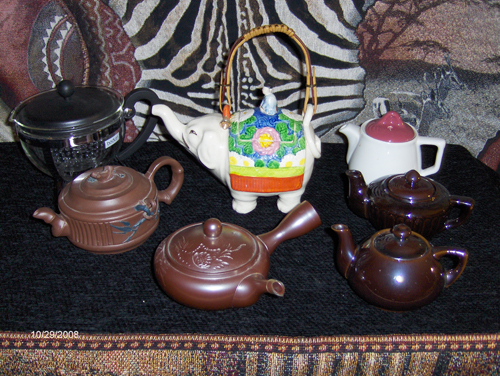
What are the coordinates of `handle` in the screenshot? It's located at (295, 38), (434, 141), (455, 250), (462, 204), (305, 218), (165, 161), (141, 97).